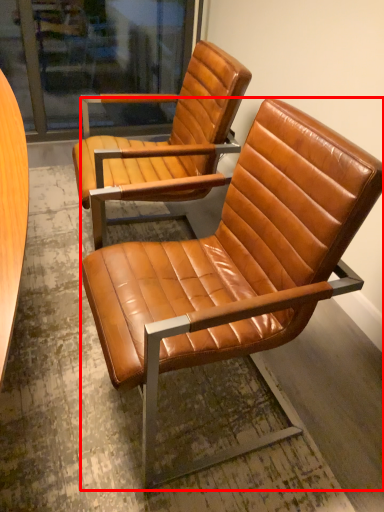
Question: Observing the image, what is the correct spatial positioning of chair (annotated by the red box) in reference to chair?

Choices:
 (A) left
 (B) right

Answer: (B)